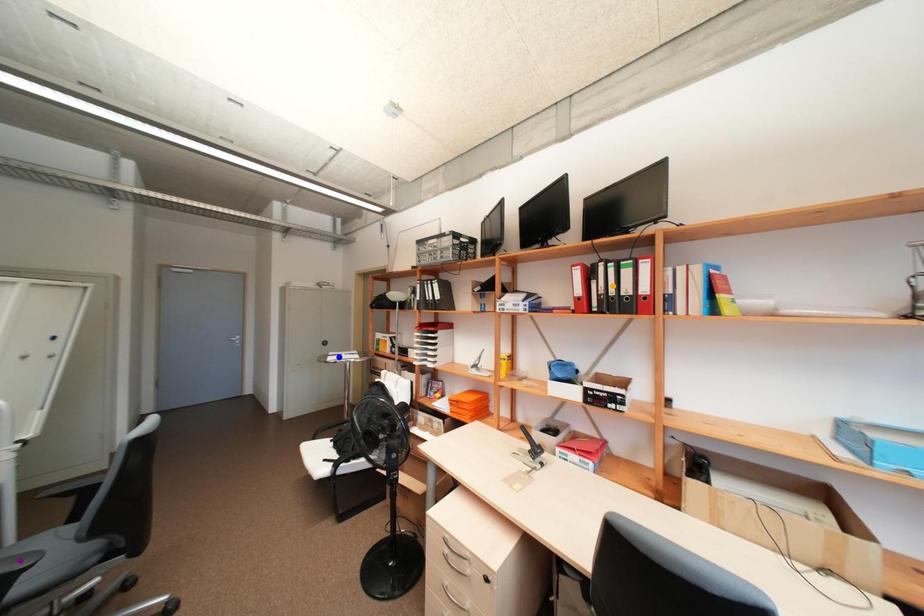
Order these from nearest to farthest:
purple point | orange point | blue point

purple point → orange point → blue point